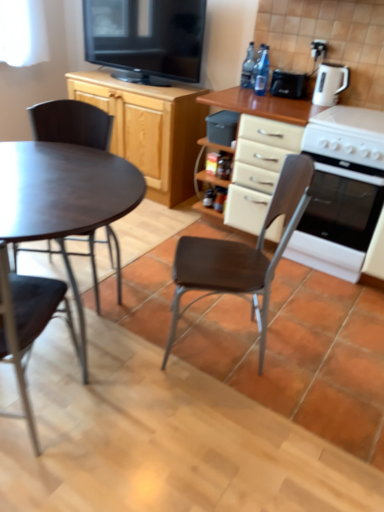
You are a GUI agent. You are given a task and a screenshot of the screen. Output one action in this format:
    pyautogui.click(x=<x>, y=<y>)
    Task: Click on the vacant space in front of white glossy oven at right
    
    Given the screenshot: What is the action you would take?
    pyautogui.click(x=330, y=298)